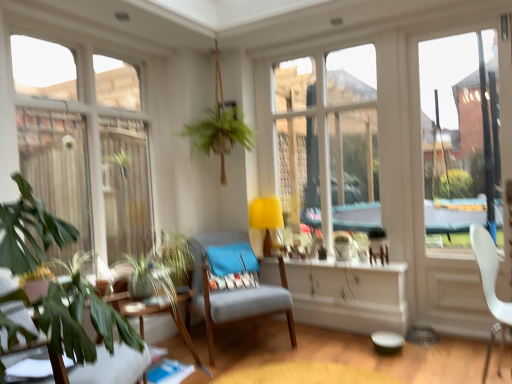
At what (x,y) coordinates should I click in order to perform the action: click on white plastic chair at right, which is the 2th chair from back to front. Please return your answer as a coordinate pair (x, y). Looking at the image, I should click on (490, 289).

Image resolution: width=512 pixels, height=384 pixels. Describe the element at coordinates (329, 135) in the screenshot. I see `clear glass window at center` at that location.

Where is `clear glass window at center`? This screenshot has height=384, width=512. clear glass window at center is located at coordinates (329, 135).

The width and height of the screenshot is (512, 384). What do you see at coordinates (231, 259) in the screenshot?
I see `blue fabric pillow at center` at bounding box center [231, 259].

Locate an element on the screen. This screenshot has height=384, width=512. green leafy plant at lower left, marked as the 3th chair in a right-to-left arrangement is located at coordinates (115, 367).

Would you say white plastic chair at right, acting as the second chair starting from the front, is outside green leafy plant at lower left, the 3th chair when ordered from back to front?

Indeed, white plastic chair at right, acting as the second chair starting from the front, is completely outside green leafy plant at lower left, the 3th chair when ordered from back to front.

Which of these two, white plastic chair at right, the first chair in the right-to-left sequence, or green leafy plant at lower left, the 3th chair when ordered from back to front, is wider?

green leafy plant at lower left, the 3th chair when ordered from back to front, is wider.

Based on the photo, from the image's perspective, is white plastic chair at right, acting as the second chair starting from the front, above or below green leafy plant at lower left, marked as the 1th chair in a front-to-back arrangement?

white plastic chair at right, acting as the second chair starting from the front, is above green leafy plant at lower left, marked as the 1th chair in a front-to-back arrangement.

From a real-world perspective, is white plastic chair at right, which is the third chair in left-to-right order, positioned under green leafy plant at lower left, the 3th chair when ordered from back to front, based on gravity?

Actually, white plastic chair at right, which is the third chair in left-to-right order, is physically above green leafy plant at lower left, the 3th chair when ordered from back to front, in the real world.

Does wooden table at lower left contain blue fabric pillow at center?

That's incorrect, blue fabric pillow at center is not inside wooden table at lower left.

In order to click on pillow above the wooden table at lower left (from the image's perspective) in this screenshot , I will do `click(231, 259)`.

Is point (136, 304) closer or farther from the camera than point (228, 247)?

Point (136, 304).

This screenshot has width=512, height=384. In order to click on window screen above the white plastic chair at right, which is the third chair in left-to-right order (from a real-world perspective) in this screenshot , I will do `click(460, 140)`.

Measure the distance between transparent glass door at right and white plastic chair at right, which is the third chair in left-to-right order.

The distance of transparent glass door at right from white plastic chair at right, which is the third chair in left-to-right order, is 3.56 feet.

From a real-world perspective, between transparent glass door at right and white plastic chair at right, acting as the second chair starting from the front, who is vertically lower?

white plastic chair at right, acting as the second chair starting from the front, is physically lower.

Is transparent glass door at right bigger or smaller than white plastic chair at right, which is the third chair in left-to-right order?

In the image, transparent glass door at right appears to be larger than white plastic chair at right, which is the third chair in left-to-right order.

Is transparent glass window at left inside the boundaries of wooden table at lower left, or outside?

transparent glass window at left is not enclosed by wooden table at lower left.

From a real-world perspective, is transparent glass window at left positioned under wooden table at lower left based on gravity?

Incorrect, from a real-world perspective, transparent glass window at left is higher than wooden table at lower left.

Considering the positions of points (22, 68) and (205, 370), is point (22, 68) farther from camera compared to point (205, 370)?

Yes.

What's the angular difference between transparent glass window at left and wooden table at lower left's facing directions?

2.11 degrees separate the facing orientations of transparent glass window at left and wooden table at lower left.

From a real-world perspective, which is physically below, yellow fabric lampshade at center or textured gray chair at center, the 2th chair from the left?

textured gray chair at center, the 2th chair from the left, is physically lower.

Considering the sizes of objects yellow fabric lampshade at center and textured gray chair at center, arranged as the 3th chair when viewed from the front, in the image provided, who is bigger, yellow fabric lampshade at center or textured gray chair at center, arranged as the 3th chair when viewed from the front,?

With larger size is textured gray chair at center, arranged as the 3th chair when viewed from the front.

Does yellow fabric lampshade at center have a greater height compared to textured gray chair at center, the 2th chair from the left?

No, yellow fabric lampshade at center is not taller than textured gray chair at center, the 2th chair from the left.

From the image's perspective, does yellow fabric lampshade at center appear lower than textured gray chair at center, the second chair in the right-to-left sequence?

No, from the image's perspective, yellow fabric lampshade at center is not below textured gray chair at center, the second chair in the right-to-left sequence.

Which is more to the right, transparent glass window at left or transparent glass door at right?

transparent glass door at right is more to the right.

Is transparent glass window at left beside transparent glass door at right?

There is a gap between transparent glass window at left and transparent glass door at right.

From the image's perspective, which is below, transparent glass window at left or transparent glass door at right?

transparent glass door at right is shown below in the image.

Considering the sizes of objects transparent glass window at left and transparent glass door at right in the image provided, who is taller, transparent glass window at left or transparent glass door at right?

With more height is transparent glass door at right.

Consider the image. Is the surface of wooden table at lower left in direct contact with white glossy window sill at center?

wooden table at lower left and white glossy window sill at center are clearly separated.

Considering the positions of point (140, 311) and point (378, 267), is point (140, 311) closer or farther from the camera than point (378, 267)?

Point (140, 311) is positioned closer to the camera compared to point (378, 267).

Can we say wooden table at lower left lies outside white glossy window sill at center?

wooden table at lower left lies outside white glossy window sill at center's area.

From the image's perspective, is wooden table at lower left located beneath white glossy window sill at center?

Yes, from the image's perspective, wooden table at lower left is beneath white glossy window sill at center.

The height and width of the screenshot is (384, 512). I want to click on the 2nd chair above the green leafy plant at lower left, which is counted as the 1th chair, starting from the left (from the image's perspective), so click(x=490, y=289).

Locate an element on the screen. pillow behind the wooden table at lower left is located at coordinates (231, 259).

When comparing their distances from transparent glass door at right, does green leafy plant at lower left, which is counted as the 1th chair, starting from the left, or wooden table at lower left seem closer?

wooden table at lower left is closer to transparent glass door at right.

Based on their spatial positions, is white glossy window sill at center or clear glass window at center closer to green leafy plant at lower left?

The object closer to green leafy plant at lower left is white glossy window sill at center.

Looking at the image, which one is located further to clear glass window at center, green leafy plant at lower left, marked as the 1th chair in a front-to-back arrangement, or green leafy plant at lower left?

green leafy plant at lower left, marked as the 1th chair in a front-to-back arrangement, is further to clear glass window at center.

Based on their spatial positions, is green leafy plant at lower left, marked as the 1th chair in a front-to-back arrangement, or transparent glass window at left further from wooden table at lower left?

transparent glass window at left is positioned further to the anchor wooden table at lower left.

Which object lies further to the anchor point wooden table at lower left, green leafy plant at lower left, the 3th chair when ordered from back to front, or green leafy plant at lower left?

The object further to wooden table at lower left is green leafy plant at lower left, the 3th chair when ordered from back to front.

When comparing their distances from yellow fabric lampshade at center, does white plastic chair at right, which is the third chair in left-to-right order, or green leafy plant at lower left seem closer?

Among the two, white plastic chair at right, which is the third chair in left-to-right order, is located nearer to yellow fabric lampshade at center.

From the picture: When comparing their distances from green leafy plant at lower left, which is counted as the 1th chair, starting from the left, does yellow fabric lampshade at center or clear glass window at center seem further?

Based on the image, clear glass window at center appears to be further to green leafy plant at lower left, which is counted as the 1th chair, starting from the left.

From the image, which object appears to be farther from white plastic chair at right, which is the third chair in left-to-right order, transparent glass window at left or yellow fabric lampshade at center?

transparent glass window at left lies further to white plastic chair at right, which is the third chair in left-to-right order, than the other object.

Find the location of a particular element. The image size is (512, 384). bay window between blue fabric pillow at center and transparent glass door at right from left to right is located at coordinates (329, 135).

At what (x,y) coordinates should I click in order to perform the action: click on window sill between green leafy plant at lower left and blue fabric pillow at center from front to back. Please return your answer as a coordinate pair (x, y). Looking at the image, I should click on (344, 266).

Image resolution: width=512 pixels, height=384 pixels. What are the coordinates of `lamp between transparent glass window at left and white glossy window sill at center` in the screenshot? It's located at (266, 218).

Identify the location of lamp between green leafy plant at lower left, the 3th chair when ordered from back to front, and white plastic chair at right, acting as the second chair starting from the front. (266, 218).